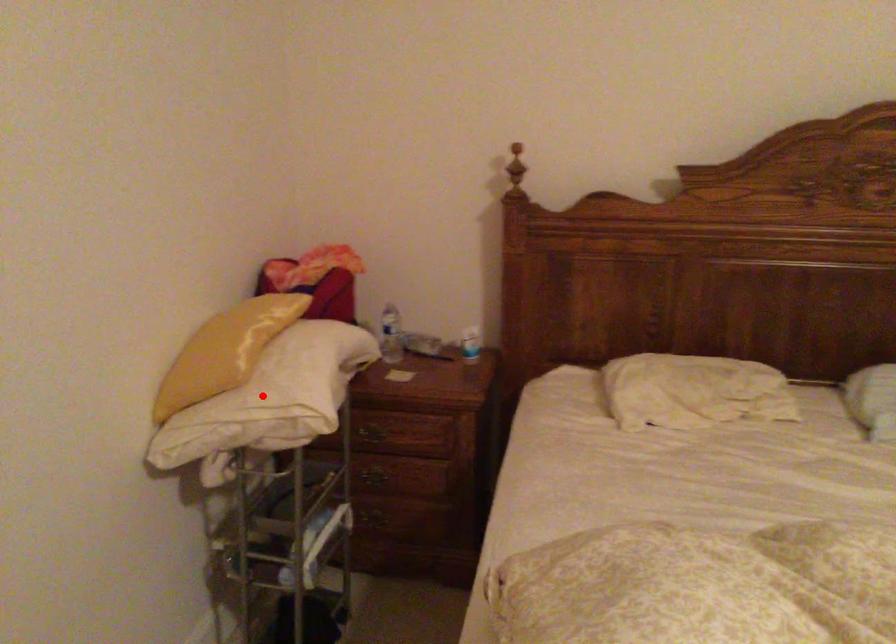
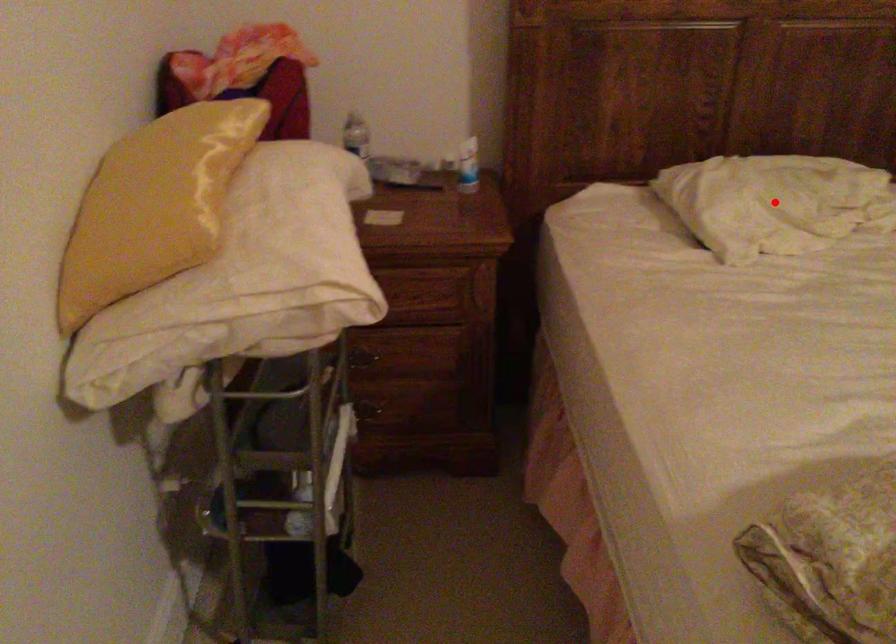
I am providing you with two images of the same scene from different viewpoints. A red point is marked on the first image and another point is marked on the second image. Does the point marked in image1 correspond to the same location as the one in image2?

No